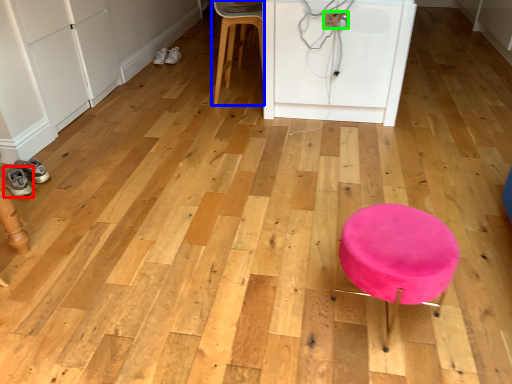
Question: Based on their relative distances, which object is farther from footwear (highlighted by a red box)? Choose from chair (highlighted by a blue box) and electric outlet (highlighted by a green box).

Choices:
 (A) chair
 (B) electric outlet

Answer: (B)